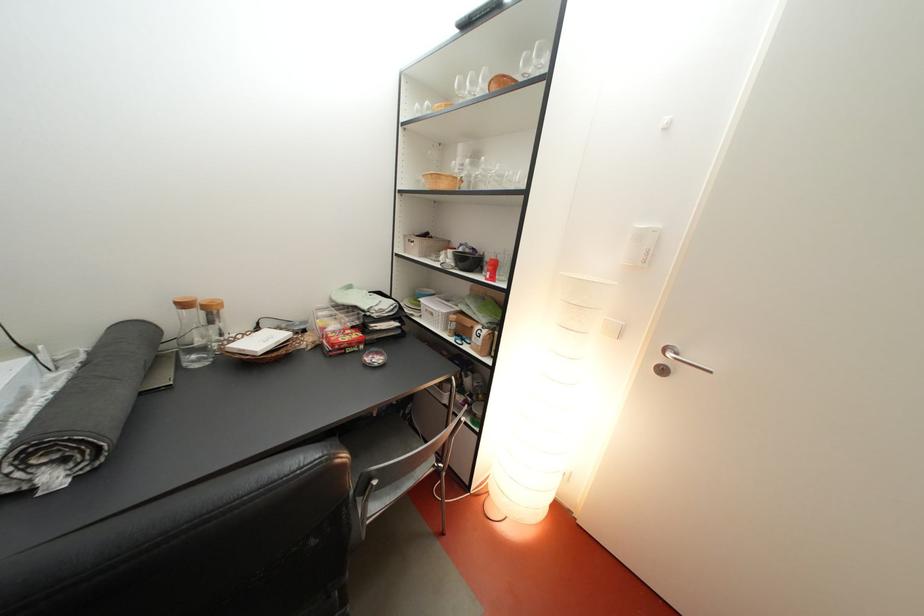
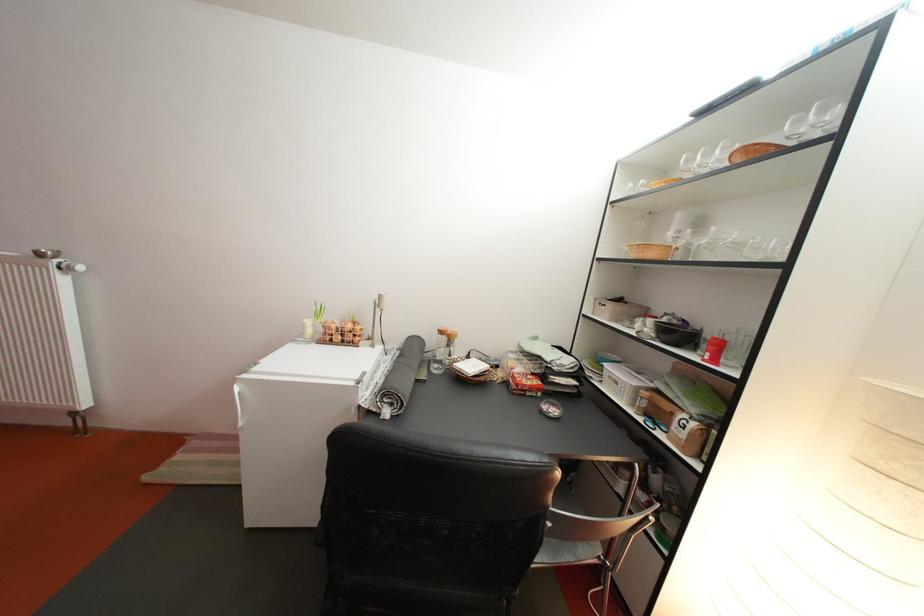
Where in the second image is the point corresponding to point 470,92 from the first image?

(698, 168)